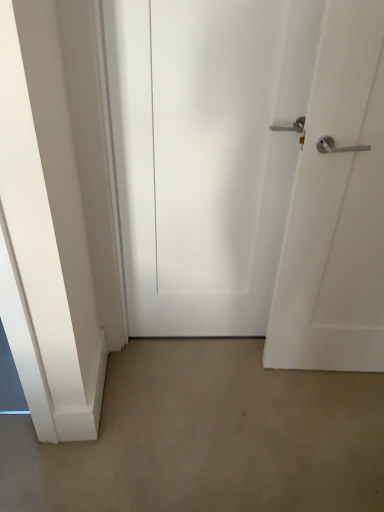
Describe the element at coordinates (207, 437) in the screenshot. I see `beige carpet at lower center` at that location.

Where is `beige carpet at lower center`? beige carpet at lower center is located at coordinates (207, 437).

Locate an element on the screen. The height and width of the screenshot is (512, 384). beige carpet at lower center is located at coordinates (207, 437).